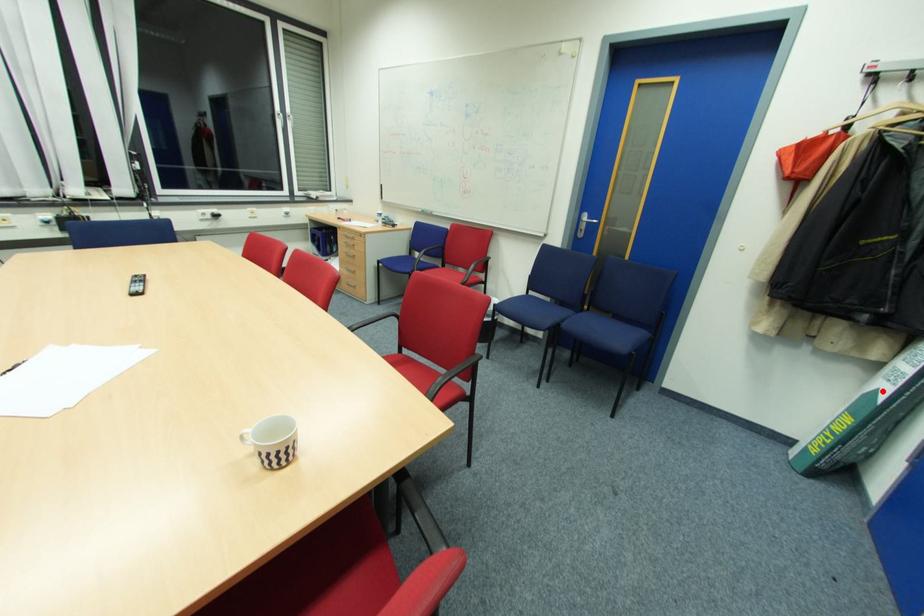
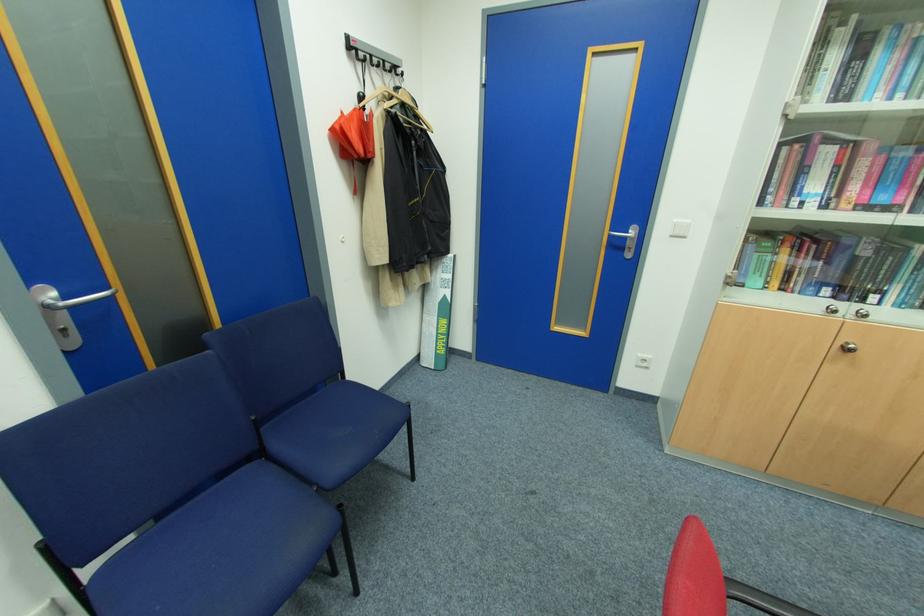
Locate, in the second image, the point that corresponds to the highlighted location in the first image.

(448, 296)